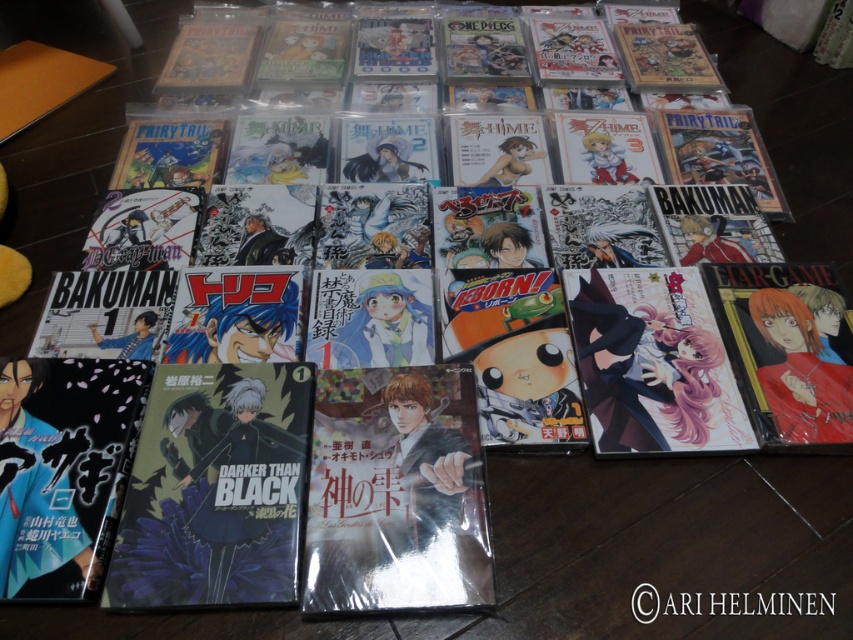
You are standing in front of the manga collection and want to touch both the point at coordinates point (370, 582) and point (611, 408). Which point will you reach first?

You will reach the point (370, 582) first because it is closer to you than point (611, 408).

You are a collector who wants to reach the matte black comic book at center on a shelf that is 30 inches away from you. Can you safely extend your hand to grab it without overreaching?

The matte black comic book at center is 33.74 inches away from the viewer. Since the shelf is only 30 inches away, the comic book is 3.74 inches beyond your reach. You may need to move closer or use a tool to retrieve it.